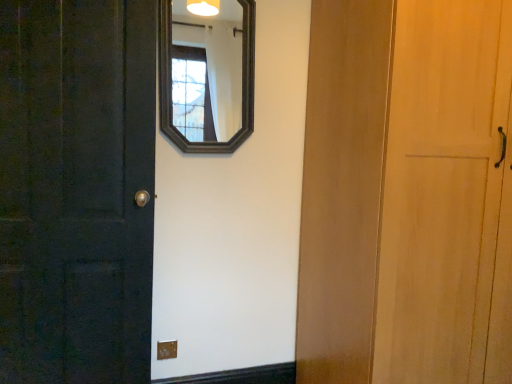
Question: Is matte brown outlet at lower center at the back of dark wood mirror at upper center?

Choices:
 (A) no
 (B) yes

Answer: (A)

Question: Is dark wood mirror at upper center far away from matte brown outlet at lower center?

Choices:
 (A) yes
 (B) no

Answer: (A)

Question: Is dark wood mirror at upper center to the left of matte brown outlet at lower center from the viewer's perspective?

Choices:
 (A) no
 (B) yes

Answer: (A)

Question: Is dark wood mirror at upper center outside matte brown outlet at lower center?

Choices:
 (A) no
 (B) yes

Answer: (B)

Question: Could you tell me if dark wood mirror at upper center is facing matte brown outlet at lower center?

Choices:
 (A) yes
 (B) no

Answer: (B)

Question: Are dark wood mirror at upper center and matte brown outlet at lower center beside each other?

Choices:
 (A) no
 (B) yes

Answer: (A)

Question: Is there a large distance between dark wood mirror at upper center and matte black door at left?

Choices:
 (A) yes
 (B) no

Answer: (A)

Question: Considering the relative sizes of dark wood mirror at upper center and matte black door at left in the image provided, is dark wood mirror at upper center shorter than matte black door at left?

Choices:
 (A) no
 (B) yes

Answer: (B)

Question: Is dark wood mirror at upper center closer to camera compared to matte black door at left?

Choices:
 (A) yes
 (B) no

Answer: (B)

Question: Is dark wood mirror at upper center not within matte black door at left?

Choices:
 (A) no
 (B) yes

Answer: (B)

Question: From a real-world perspective, is dark wood mirror at upper center beneath matte black door at left?

Choices:
 (A) no
 (B) yes

Answer: (A)

Question: Is dark wood mirror at upper center positioned behind matte black door at left?

Choices:
 (A) no
 (B) yes

Answer: (B)

Question: Is matte black door at left placed right next to matte brown outlet at lower center?

Choices:
 (A) no
 (B) yes

Answer: (A)